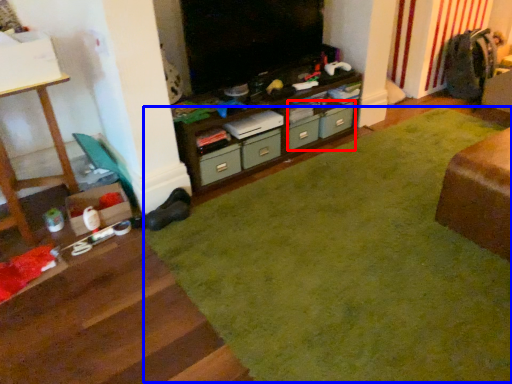
Question: Which point is further to the camera, drawer (highlighted by a red box) or plain (highlighted by a blue box)?

Choices:
 (A) drawer
 (B) plain

Answer: (A)